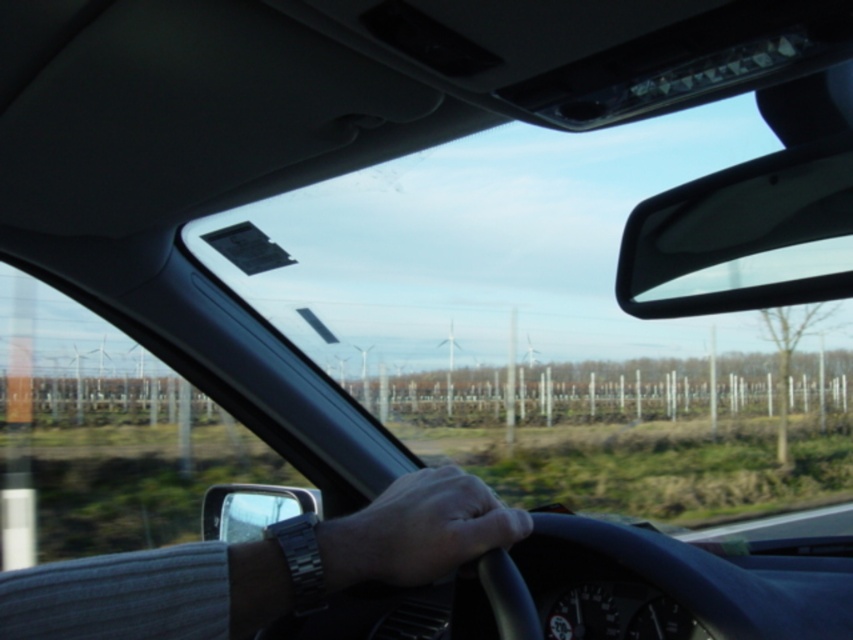
Is smooth skin hand at center shorter than clear plastic side mirror at lower left?

Correct, smooth skin hand at center is not as tall as clear plastic side mirror at lower left.

Where is `smooth skin hand at center`? This screenshot has height=640, width=853. smooth skin hand at center is located at coordinates (416, 531).

Locate an element on the screen. smooth skin hand at center is located at coordinates (416, 531).

Which is behind, point (173, 595) or point (395, 570)?

The point (395, 570) is more distant.

Is silver metallic wristwatch at center wider than smooth skin hand at center?

Yes, silver metallic wristwatch at center is wider than smooth skin hand at center.

Between point (196, 636) and point (366, 525), which one is positioned behind?

Point (366, 525)

Image resolution: width=853 pixels, height=640 pixels. I want to click on silver metallic wristwatch at center, so click(x=149, y=593).

Between silver metallic wristwatch at center and black glossy view mirror at upper right, which one has more height?

With more height is black glossy view mirror at upper right.

Can you confirm if silver metallic wristwatch at center is positioned to the left of black glossy view mirror at upper right?

Correct, you'll find silver metallic wristwatch at center to the left of black glossy view mirror at upper right.

The height and width of the screenshot is (640, 853). I want to click on silver metallic wristwatch at center, so click(x=149, y=593).